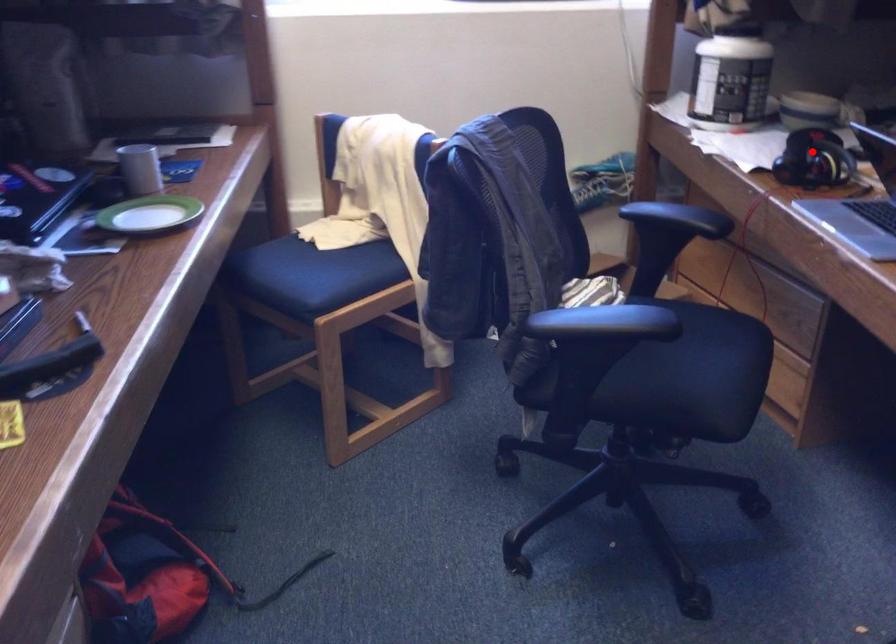
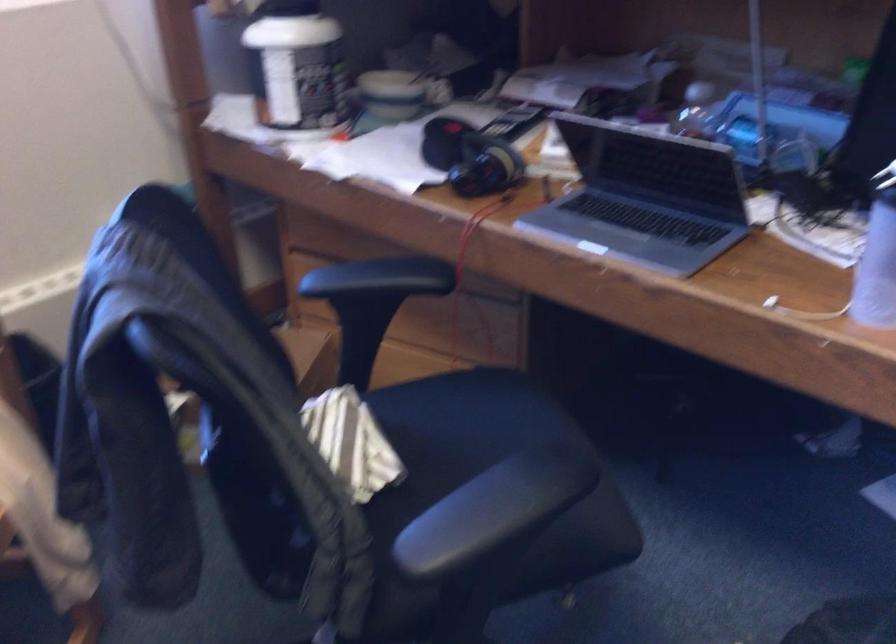
The point at the highlighted location is marked in the first image. Where is the corresponding point in the second image?

(470, 158)